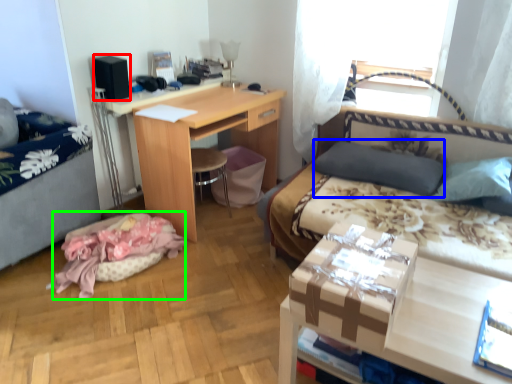
Question: Which is nearer to the box (highlighted by a red box)? pillow (highlighted by a blue box) or material (highlighted by a green box).

Choices:
 (A) pillow
 (B) material

Answer: (B)